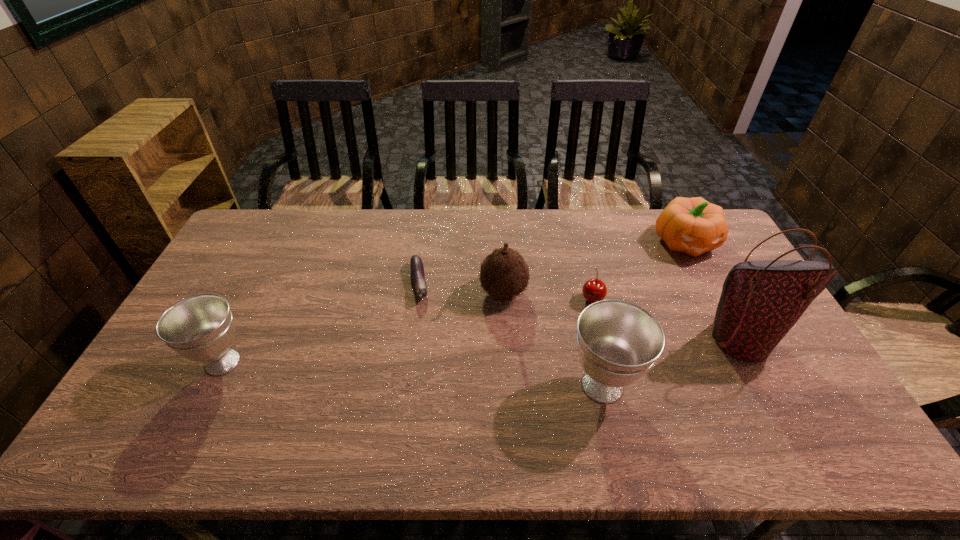
Where is `free space for an extra chalice to achieve even spacing`? free space for an extra chalice to achieve even spacing is located at coordinates (408, 374).